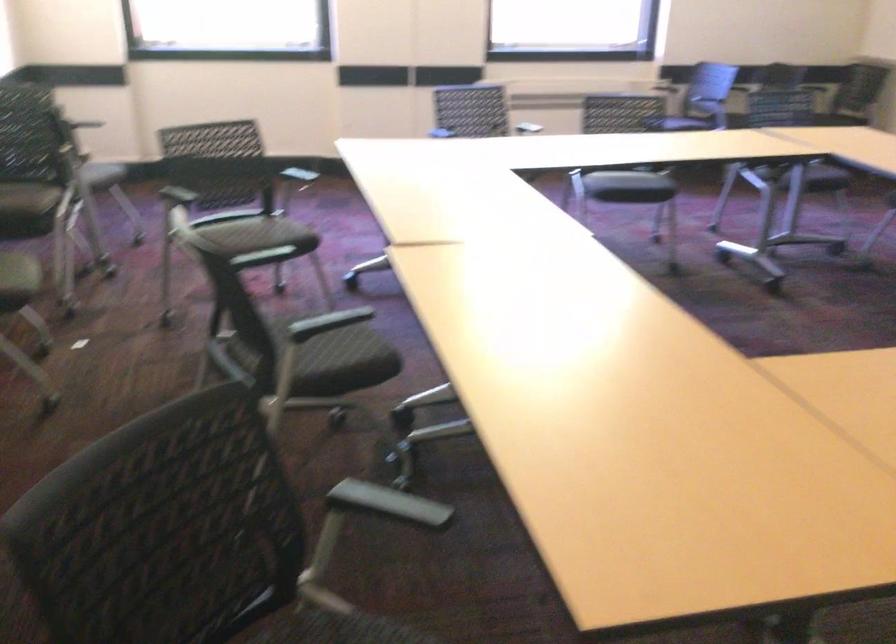
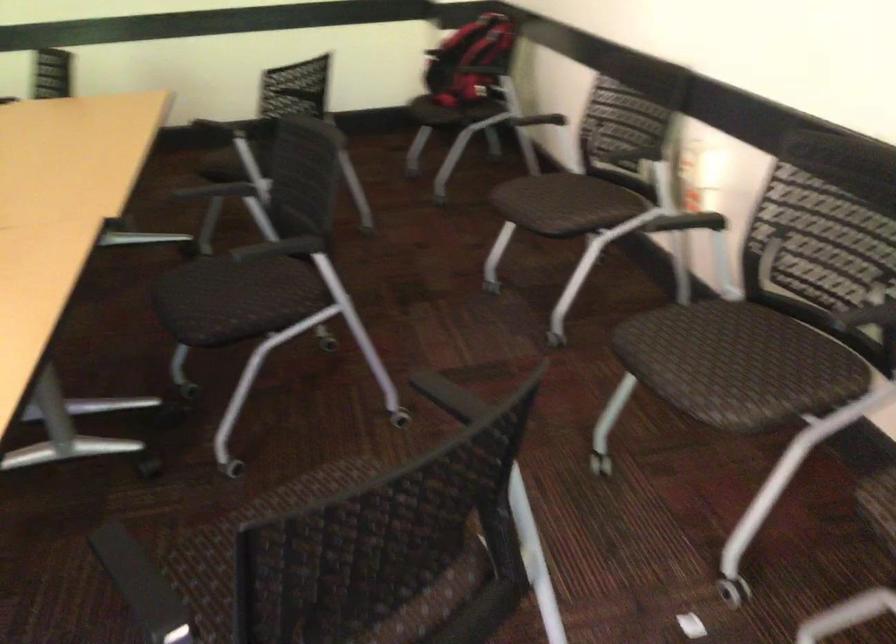
In the second image, find the point that corresponds to pixel 328 339 in the first image.

(222, 301)